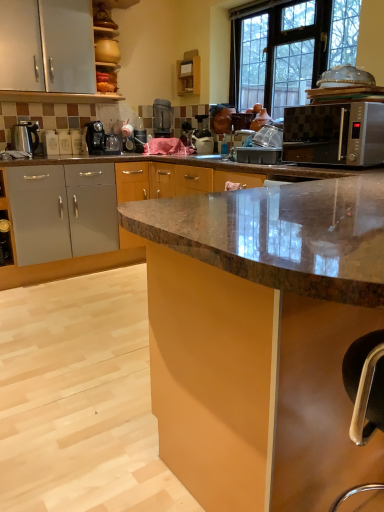
Question: Is wooden shelf at upper center, the first cabinetry viewed from the back, placed right next to satin black coffee machine at center, positioned as the first coffee machine in back-to-front order?

Choices:
 (A) no
 (B) yes

Answer: (A)

Question: Are wooden shelf at upper center, the second cabinetry viewed from the right, and satin black coffee machine at center, positioned as the first coffee machine in back-to-front order, far apart?

Choices:
 (A) no
 (B) yes

Answer: (A)

Question: Is wooden shelf at upper center, the 1th cabinetry in the top-to-bottom sequence, at the right side of satin black coffee machine at center, which ranks as the 2th coffee machine in front-to-back order?

Choices:
 (A) yes
 (B) no

Answer: (A)

Question: Is satin black coffee machine at center, marked as the first coffee machine in a right-to-left arrangement, inside wooden shelf at upper center, the 1th cabinetry in the top-to-bottom sequence?

Choices:
 (A) yes
 (B) no

Answer: (B)

Question: From a real-world perspective, is wooden shelf at upper center, the first cabinetry viewed from the back, physically above satin black coffee machine at center, marked as the first coffee machine in a right-to-left arrangement?

Choices:
 (A) yes
 (B) no

Answer: (A)

Question: Considering the relative sizes of wooden shelf at upper center, positioned as the 2th cabinetry in bottom-to-top order, and satin black coffee machine at center, positioned as the first coffee machine in back-to-front order, in the image provided, is wooden shelf at upper center, positioned as the 2th cabinetry in bottom-to-top order, smaller than satin black coffee machine at center, positioned as the first coffee machine in back-to-front order,?

Choices:
 (A) no
 (B) yes

Answer: (B)

Question: Considering the relative sizes of transparent glass window at upper center and matte brown cabinet at center, which is counted as the second cabinetry, starting from the left, in the image provided, is transparent glass window at upper center shorter than matte brown cabinet at center, which is counted as the second cabinetry, starting from the left,?

Choices:
 (A) yes
 (B) no

Answer: (B)

Question: Are transparent glass window at upper center and matte brown cabinet at center, which is the first cabinetry from bottom to top, beside each other?

Choices:
 (A) yes
 (B) no

Answer: (B)

Question: Is transparent glass window at upper center to the right of matte brown cabinet at center, the 2th cabinetry from the back, from the viewer's perspective?

Choices:
 (A) yes
 (B) no

Answer: (A)

Question: Is transparent glass window at upper center far from matte brown cabinet at center, the 2th cabinetry from the back?

Choices:
 (A) yes
 (B) no

Answer: (A)

Question: From the image's perspective, does transparent glass window at upper center appear lower than matte brown cabinet at center, which is the first cabinetry from bottom to top?

Choices:
 (A) yes
 (B) no

Answer: (B)

Question: Is matte brown cabinet at center, which ranks as the 1th cabinetry in right-to-left order, at the back of transparent glass window at upper center?

Choices:
 (A) no
 (B) yes

Answer: (A)

Question: Considering the relative positions of matte brown cabinet at center, which ranks as the 1th cabinetry in right-to-left order, and wooden shelf at upper center, the second cabinetry viewed from the right, in the image provided, is matte brown cabinet at center, which ranks as the 1th cabinetry in right-to-left order, in front of wooden shelf at upper center, the second cabinetry viewed from the right,?

Choices:
 (A) yes
 (B) no

Answer: (A)